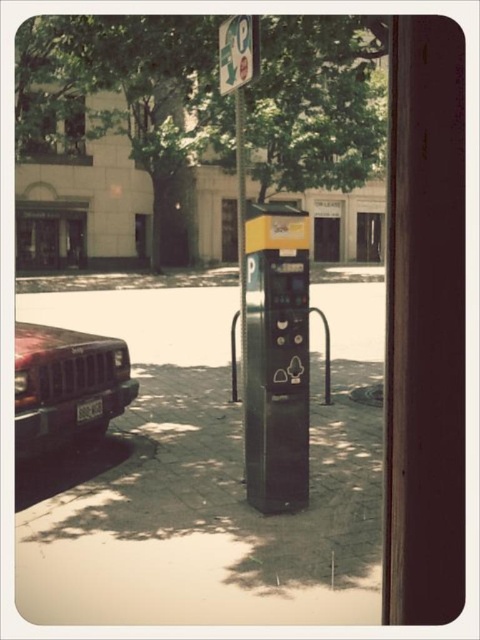
You are a delivery person trying to park your van next to the black plastic parking meter at center and the matte red car at left. Your van is 2.5 meters wide. Can you fit your van between the two vehicles?

The black plastic parking meter at center is much taller than the matte red car at left, but this information does not provide details about the distance between them. Without knowing the space between the two vehicles, it is impossible to determine if the van can fit.

You are a delivery person trying to park your van. You notice the concrete pavement at center and the white plastic license plate at lower left in the scene. Which object is located underneath the other?

The concrete pavement at center is positioned under the white plastic license plate at lower left, meaning the license plate is above the pavement.